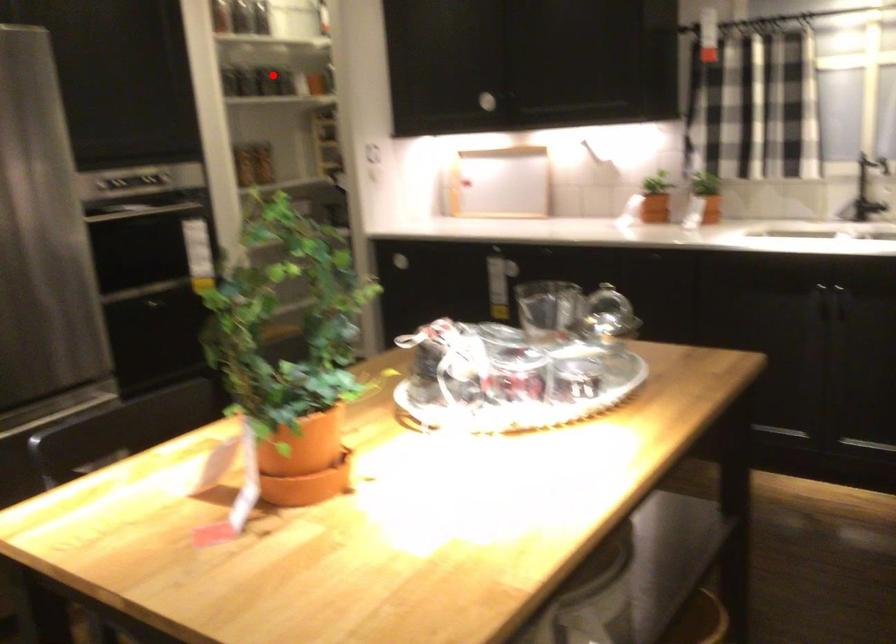
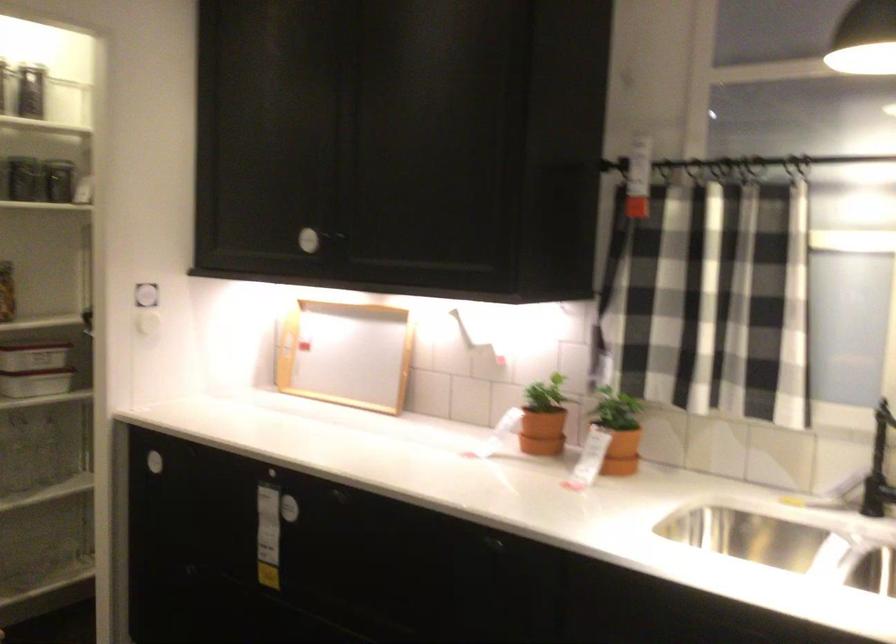
Question: I am providing you with two images of the same scene from different viewpoints. Given a red point in image1, look at the same physical point in image2. Is it:

Choices:
 (A) Closer to the viewpoint
 (B) Farther from the viewpoint

Answer: (A)